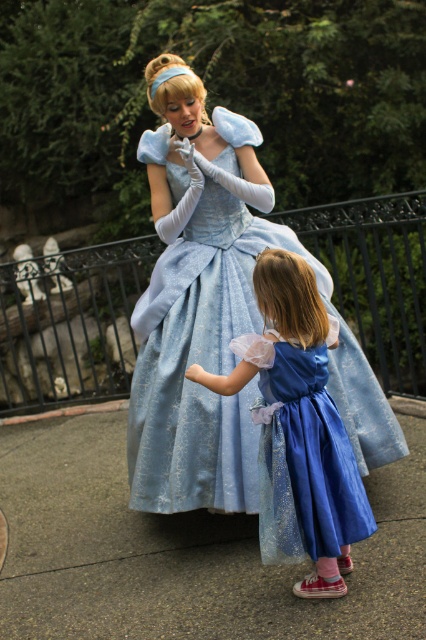
You are standing in front of the scene and want to find the light blue satin dress at center. Based on the coordinates provided, can you determine its exact location relative to the image frame?

The light blue satin dress at center is located at coordinates point (201, 362), which means it is positioned slightly to the right of the image frame and halfway down vertically.

You are a costume designer observing the scene. You need to determine which dress is more suitable for a princess character based on their height. Which dress is taller between the light blue satin dress at center and the matte blue dress at center?

The light blue satin dress at center is taller than the matte blue dress at center, making it more suitable for a princess character due to its height.